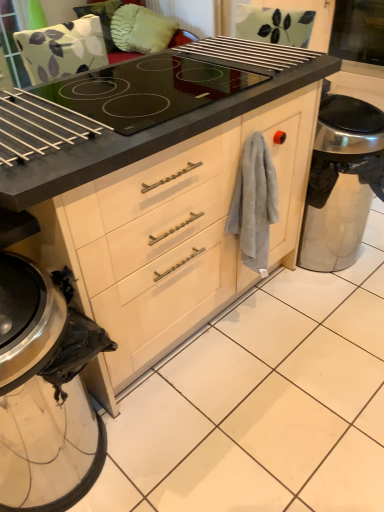
Where is `metallic silver trash can at lower left`? metallic silver trash can at lower left is located at coordinates (45, 391).

Image resolution: width=384 pixels, height=512 pixels. Find the location of `transparent glass screen door at upper right`. transparent glass screen door at upper right is located at coordinates (358, 31).

This screenshot has width=384, height=512. Find the location of `metallic silver trash can at lower left`. metallic silver trash can at lower left is located at coordinates (45, 391).

Locate an element on the screen. screen door above the gray cotton towel at right (from a real-world perspective) is located at coordinates (358, 31).

Can you confirm if transparent glass screen door at upper right is wider than gray cotton towel at right?

Yes, transparent glass screen door at upper right is wider than gray cotton towel at right.

How many degrees apart are the facing directions of transparent glass screen door at upper right and gray cotton towel at right?

The angle between the facing direction of transparent glass screen door at upper right and the facing direction of gray cotton towel at right is 87.6 degrees.

From the picture: Does transparent glass screen door at upper right appear on the left side of gray cotton towel at right?

No, transparent glass screen door at upper right is not to the left of gray cotton towel at right.

Is metallic silver trash can at lower left positioned beyond the bounds of gray cotton towel at right?

metallic silver trash can at lower left is positioned outside gray cotton towel at right.

Is gray cotton towel at right at the back of metallic silver trash can at lower left?

No, metallic silver trash can at lower left is not facing away from gray cotton towel at right.

Between metallic silver trash can at lower left and gray cotton towel at right, which one appears on the right side from the viewer's perspective?

From the viewer's perspective, gray cotton towel at right appears more on the right side.

Is metallic silver trash can at lower left bigger than gray cotton towel at right?

Correct, metallic silver trash can at lower left is larger in size than gray cotton towel at right.

From the image's perspective, which is above, satin silver trash can at lower right or transparent glass screen door at upper right?

transparent glass screen door at upper right appears higher in the image.

How many degrees apart are the facing directions of satin silver trash can at lower right and transparent glass screen door at upper right?

87.5 degrees.

Where is `appliance below the transparent glass screen door at upper right (from a real-world perspective)`? appliance below the transparent glass screen door at upper right (from a real-world perspective) is located at coordinates (342, 182).

Is satin silver trash can at lower right positioned in front of transparent glass screen door at upper right?

Yes, satin silver trash can at lower right is in front of transparent glass screen door at upper right.

Between transparent glass screen door at upper right and satin silver trash can at lower right, which one has more height?

With more height is satin silver trash can at lower right.

Is transparent glass screen door at upper right located outside satin silver trash can at lower right?

That's correct, transparent glass screen door at upper right is outside of satin silver trash can at lower right.

Between transparent glass screen door at upper right and satin silver trash can at lower right, which one appears on the left side from the viewer's perspective?

From the viewer's perspective, satin silver trash can at lower right appears more on the left side.

Between point (339, 16) and point (332, 236), which one is positioned behind?

The point (339, 16) is more distant.

From a real-world perspective, who is located lower, transparent glass screen door at upper right or metallic silver trash can at lower left?

In real-world perspective, metallic silver trash can at lower left is lower.

Are transparent glass screen door at upper right and metallic silver trash can at lower left located far from each other?

Absolutely, transparent glass screen door at upper right is distant from metallic silver trash can at lower left.

From the image's perspective, relative to metallic silver trash can at lower left, is transparent glass screen door at upper right above or below?

From the image's perspective, transparent glass screen door at upper right appears above metallic silver trash can at lower left.

Is point (350, 55) farther from camera compared to point (97, 335)?

That is True.

How many degrees apart are the facing directions of metallic silver trash can at lower left and satin silver trash can at lower right?

The angular difference between metallic silver trash can at lower left and satin silver trash can at lower right is 0.00123 degrees.

Is metallic silver trash can at lower left behind satin silver trash can at lower right?

No, metallic silver trash can at lower left is closer to the camera.

Considering the relative sizes of metallic silver trash can at lower left and satin silver trash can at lower right in the image provided, is metallic silver trash can at lower left thinner than satin silver trash can at lower right?

No.

Is metallic silver trash can at lower left looking in the opposite direction of satin silver trash can at lower right?

No, metallic silver trash can at lower left is not facing away from satin silver trash can at lower right.

Which object is further away from the camera taking this photo, metallic silver trash can at lower left or transparent glass screen door at upper right?

transparent glass screen door at upper right is more distant.

From their relative heights in the image, would you say metallic silver trash can at lower left is taller or shorter than transparent glass screen door at upper right?

metallic silver trash can at lower left is taller than transparent glass screen door at upper right.

Find the location of a particular element. kitchen appliance lying in front of the transparent glass screen door at upper right is located at coordinates (45, 391).

Where is `material below the transparent glass screen door at upper right (from the image's perspective)`? material below the transparent glass screen door at upper right (from the image's perspective) is located at coordinates (254, 203).

The width and height of the screenshot is (384, 512). I want to click on material that is above the metallic silver trash can at lower left (from a real-world perspective), so pyautogui.click(x=254, y=203).

When comparing their distances from transparent glass screen door at upper right, does satin silver trash can at lower right or metallic silver trash can at lower left seem closer?

satin silver trash can at lower right is positioned closer to the anchor transparent glass screen door at upper right.

Considering their positions, is gray cotton towel at right positioned further to satin silver trash can at lower right than transparent glass screen door at upper right?

transparent glass screen door at upper right lies further to satin silver trash can at lower right than the other object.

In the scene shown: Looking at the image, which one is located further to transparent glass screen door at upper right, gray cotton towel at right or metallic silver trash can at lower left?

metallic silver trash can at lower left lies further to transparent glass screen door at upper right than the other object.

Based on their spatial positions, is metallic silver trash can at lower left or transparent glass screen door at upper right further from gray cotton towel at right?

Based on the image, transparent glass screen door at upper right appears to be further to gray cotton towel at right.

Based on their spatial positions, is transparent glass screen door at upper right or metallic silver trash can at lower left further from gray cotton towel at right?

transparent glass screen door at upper right lies further to gray cotton towel at right than the other object.

Considering their positions, is satin silver trash can at lower right positioned closer to transparent glass screen door at upper right than gray cotton towel at right?

Among the two, satin silver trash can at lower right is located nearer to transparent glass screen door at upper right.

Estimate the real-world distances between objects in this image. Which object is further from satin silver trash can at lower right, transparent glass screen door at upper right or metallic silver trash can at lower left?

Based on the image, metallic silver trash can at lower left appears to be further to satin silver trash can at lower right.

Which object lies further to the anchor point metallic silver trash can at lower left, satin silver trash can at lower right or gray cotton towel at right?

The object further to metallic silver trash can at lower left is satin silver trash can at lower right.

Locate an element on the screen. This screenshot has height=512, width=384. appliance between transparent glass screen door at upper right and metallic silver trash can at lower left in the up-down direction is located at coordinates (342, 182).

Where is `material that lies between transparent glass screen door at upper right and metallic silver trash can at lower left from top to bottom`? material that lies between transparent glass screen door at upper right and metallic silver trash can at lower left from top to bottom is located at coordinates (254, 203).

Locate an element on the screen. material between metallic silver trash can at lower left and satin silver trash can at lower right is located at coordinates (254, 203).

Where is `appliance between transparent glass screen door at upper right and gray cotton towel at right from top to bottom`? The width and height of the screenshot is (384, 512). appliance between transparent glass screen door at upper right and gray cotton towel at right from top to bottom is located at coordinates (342, 182).